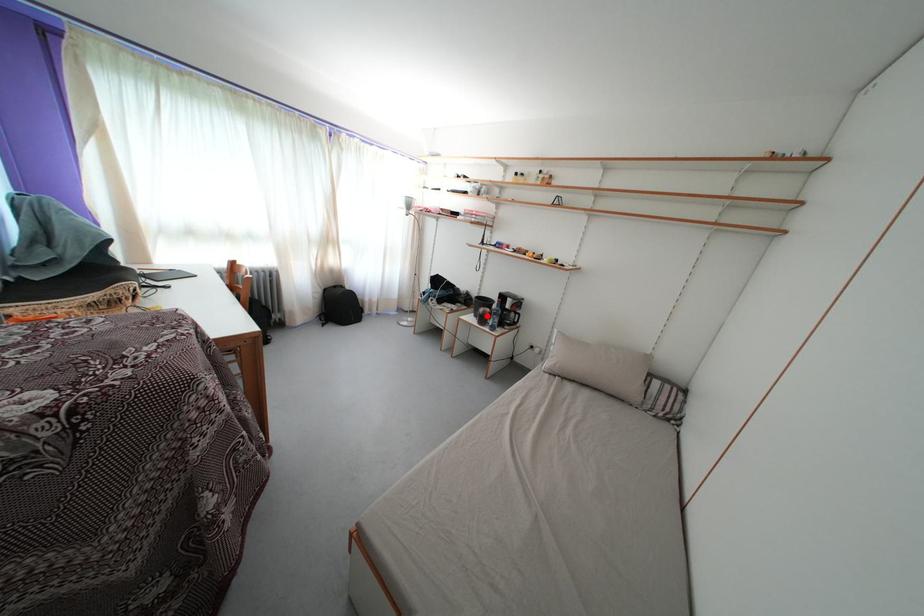
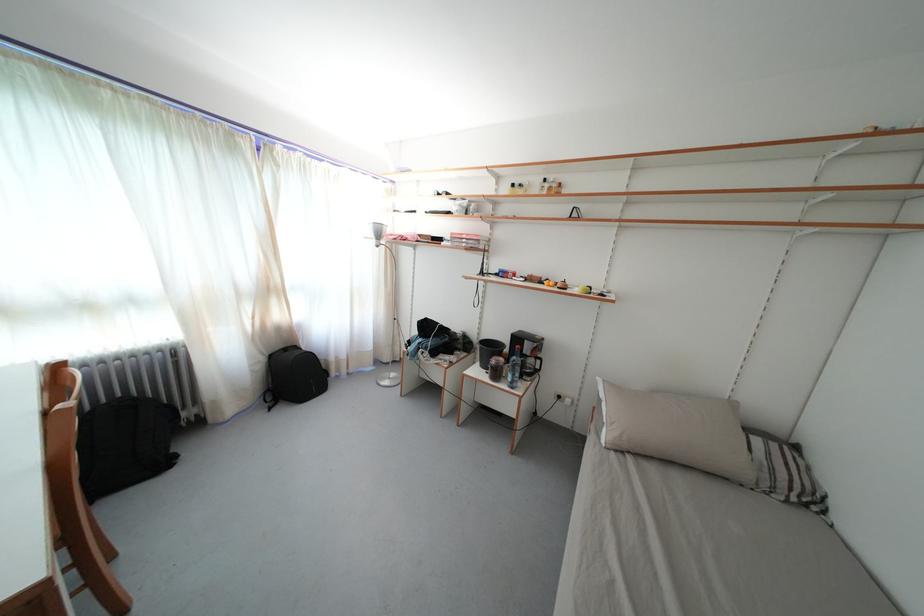
The point at the highlighted location is marked in the first image. Where is the corresponding point in the second image?

(499, 367)